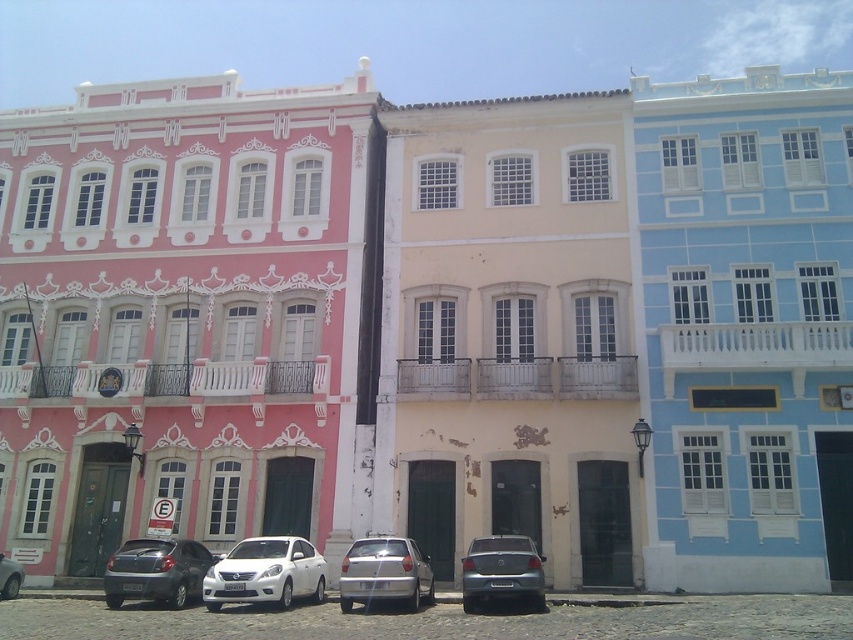
Question: Considering the real-world distances, which object is farthest from the metallic gray hatchback at lower left?

Choices:
 (A) white glossy sedan at center
 (B) silver metallic car at lower left
 (C) silver metallic sedan at center

Answer: (C)

Question: Can you confirm if white glossy sedan at center is thinner than silver metallic sedan at center?

Choices:
 (A) yes
 (B) no

Answer: (B)

Question: Is silver metallic hatchback at center bigger than silver metallic sedan at center?

Choices:
 (A) no
 (B) yes

Answer: (B)

Question: Which point is farther to the camera?

Choices:
 (A) silver metallic hatchback at center
 (B) silver metallic sedan at center
 (C) silver metallic car at lower left
 (D) white glossy sedan at center

Answer: (C)

Question: Among these points, which one is farthest from the camera?

Choices:
 (A) pos(213,605)
 (B) pos(399,548)
 (C) pos(186,557)
 (D) pos(20,582)

Answer: (D)

Question: Can you confirm if white glossy sedan at center is positioned to the left of silver metallic hatchback at center?

Choices:
 (A) no
 (B) yes

Answer: (B)